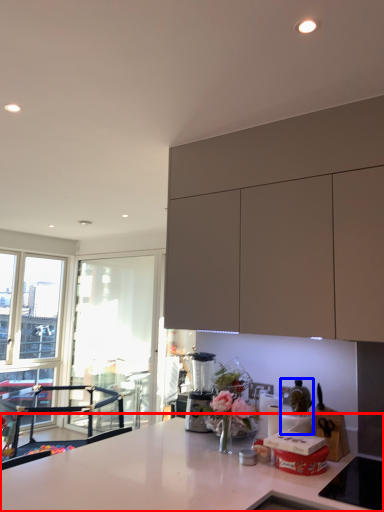
Question: Which point is closer to the camera, countertop (highlighted by a red box) or appliance (highlighted by a blue box)?

Choices:
 (A) countertop
 (B) appliance

Answer: (A)